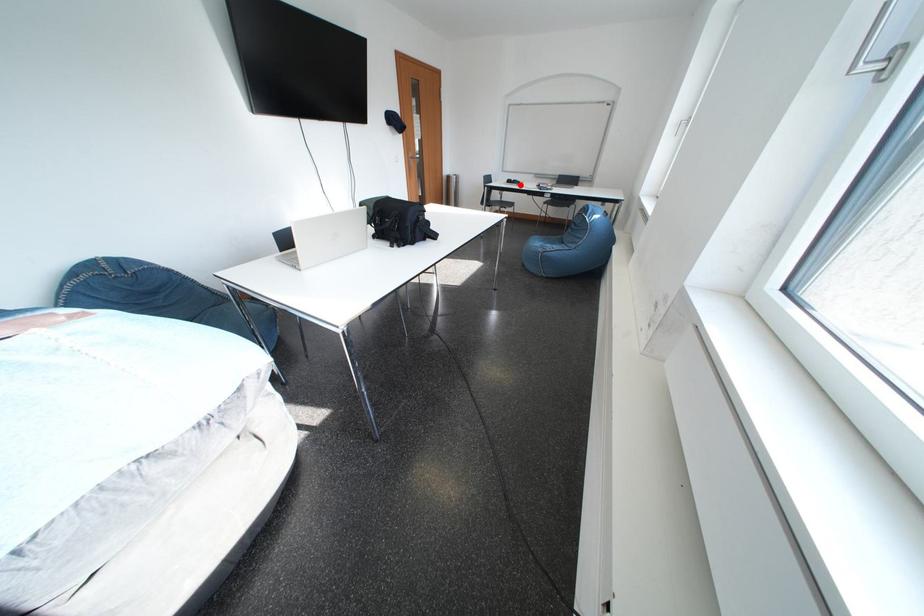
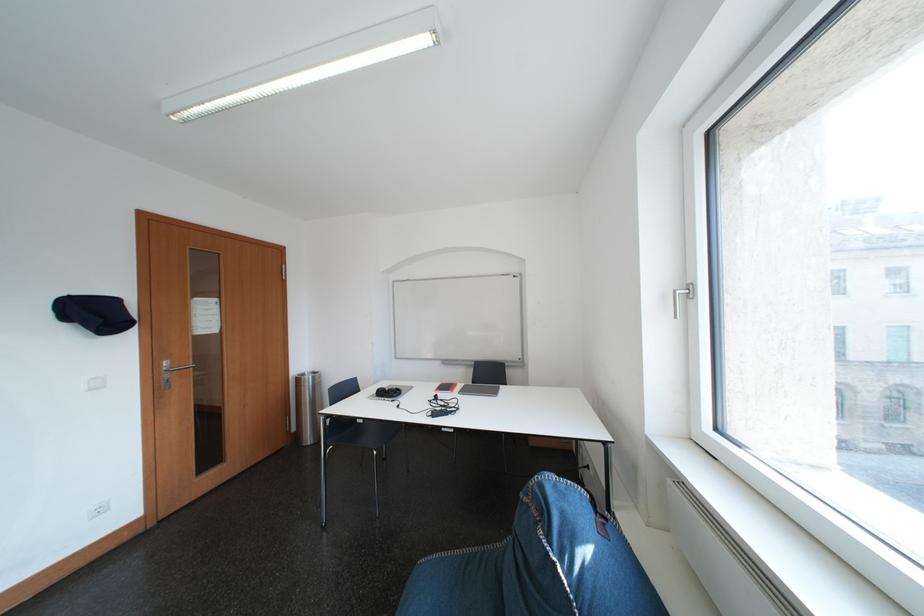
Question: I am providing you with two images of the same scene from different viewpoints. Given a red point in image1, look at the same physical point in image2. Is it:

Choices:
 (A) Closer to the viewpoint
 (B) Farther from the viewpoint

Answer: (A)